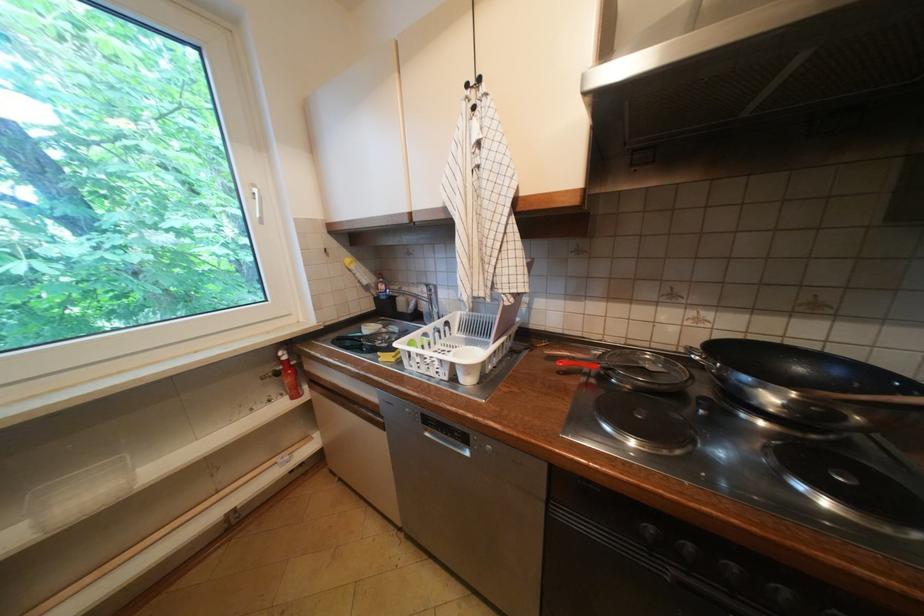
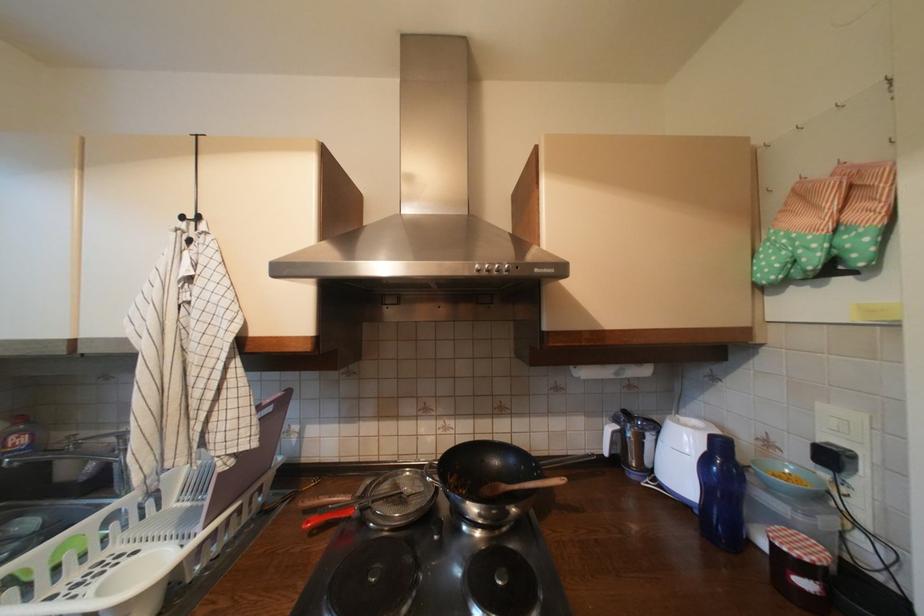
Locate, in the second image, the point that corresponds to point 475,99 in the first image.

(187, 230)